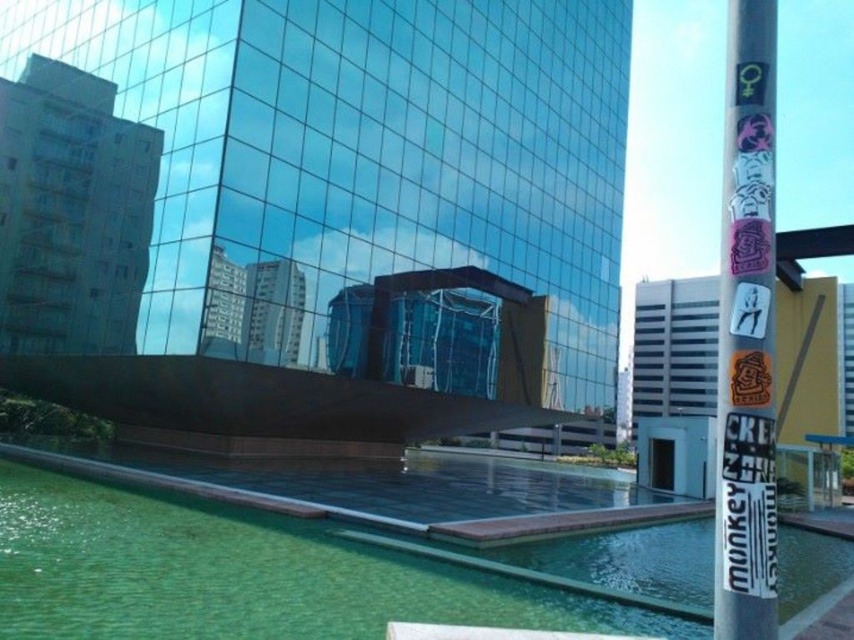
Question: Does green glass pool at center have a larger size compared to silver metallic pole at right?

Choices:
 (A) yes
 (B) no

Answer: (B)

Question: Is green glass pool at center positioned at the back of silver metallic pole at right?

Choices:
 (A) no
 (B) yes

Answer: (A)

Question: Which of the following is the farthest from the observer?

Choices:
 (A) (763, 289)
 (B) (311, 561)

Answer: (B)

Question: Is green glass pool at center closer to camera compared to silver metallic pole at right?

Choices:
 (A) yes
 (B) no

Answer: (A)

Question: Among these objects, which one is farthest from the camera?

Choices:
 (A) green glass pool at center
 (B) silver metallic pole at right

Answer: (B)